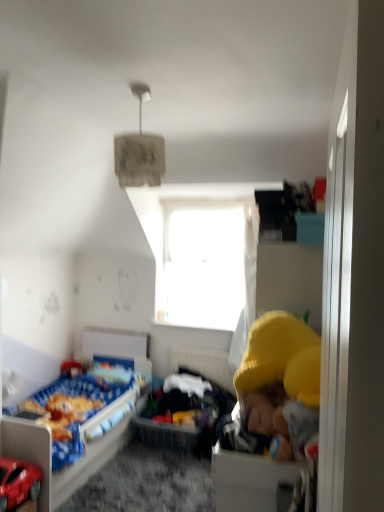
Question: From a real-world perspective, is shiny red car at lower left on top of textured paper lampshade at upper center?

Choices:
 (A) yes
 (B) no

Answer: (B)

Question: From a real-world perspective, is shiny red car at lower left beneath textured paper lampshade at upper center?

Choices:
 (A) yes
 (B) no

Answer: (A)

Question: Considering the relative sizes of shiny red car at lower left and textured paper lampshade at upper center in the image provided, is shiny red car at lower left smaller than textured paper lampshade at upper center?

Choices:
 (A) no
 (B) yes

Answer: (A)

Question: Considering the relative sizes of shiny red car at lower left and textured paper lampshade at upper center in the image provided, is shiny red car at lower left thinner than textured paper lampshade at upper center?

Choices:
 (A) no
 (B) yes

Answer: (A)

Question: Is shiny red car at lower left facing away from textured paper lampshade at upper center?

Choices:
 (A) no
 (B) yes

Answer: (A)

Question: Visually, is transparent glass window at center positioned to the left or to the right of textured paper lampshade at upper center?

Choices:
 (A) left
 (B) right

Answer: (B)

Question: Which is correct: transparent glass window at center is inside textured paper lampshade at upper center, or outside of it?

Choices:
 (A) inside
 (B) outside

Answer: (B)

Question: In terms of height, does transparent glass window at center look taller or shorter compared to textured paper lampshade at upper center?

Choices:
 (A) tall
 (B) short

Answer: (A)

Question: Considering the positions of transparent glass window at center and textured paper lampshade at upper center in the image, is transparent glass window at center bigger or smaller than textured paper lampshade at upper center?

Choices:
 (A) big
 (B) small

Answer: (A)

Question: In the image, is textured paper lampshade at upper center positioned in front of or behind white plastic drawer at lower right?

Choices:
 (A) front
 (B) behind

Answer: (B)

Question: Considering the positions of textured paper lampshade at upper center and white plastic drawer at lower right in the image, is textured paper lampshade at upper center bigger or smaller than white plastic drawer at lower right?

Choices:
 (A) big
 (B) small

Answer: (A)

Question: From a real-world perspective, relative to white plastic drawer at lower right, is textured paper lampshade at upper center vertically above or below?

Choices:
 (A) above
 (B) below

Answer: (A)

Question: Considering the relative positions of textured paper lampshade at upper center and white plastic drawer at lower right in the image provided, is textured paper lampshade at upper center to the left or to the right of white plastic drawer at lower right?

Choices:
 (A) left
 (B) right

Answer: (A)

Question: Relative to textured paper lampshade at upper center, is blue fabric bed at lower left in front or behind?

Choices:
 (A) behind
 (B) front

Answer: (A)

Question: In terms of height, does blue fabric bed at lower left look taller or shorter compared to textured paper lampshade at upper center?

Choices:
 (A) short
 (B) tall

Answer: (B)